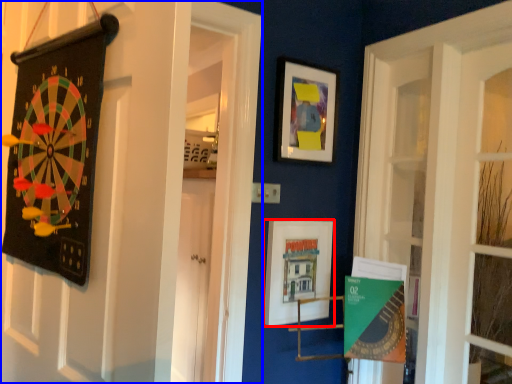
Question: Which point is closer to the camera, picture frame (highlighted by a red box) or door (highlighted by a blue box)?

Choices:
 (A) picture frame
 (B) door

Answer: (B)